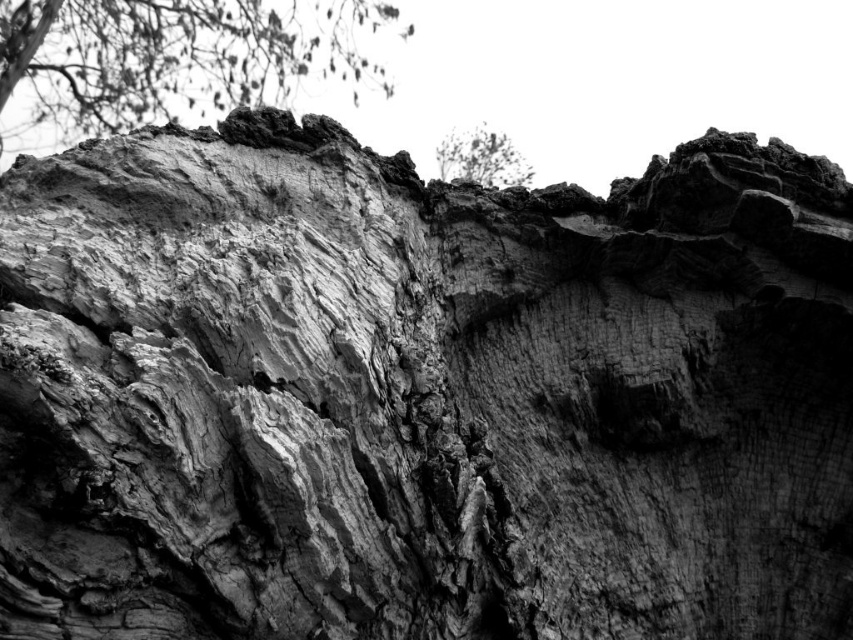
Does rough bark tree trunk at upper left lie in front of dark gray textured bark at upper center?

No, it is behind dark gray textured bark at upper center.

Which of these two, rough bark tree trunk at upper left or dark gray textured bark at upper center, stands shorter?

Standing shorter between the two is dark gray textured bark at upper center.

Is point (155, 84) positioned after point (488, 156)?

Yes, it is.

This screenshot has height=640, width=853. I want to click on rough bark tree trunk at upper left, so click(x=178, y=54).